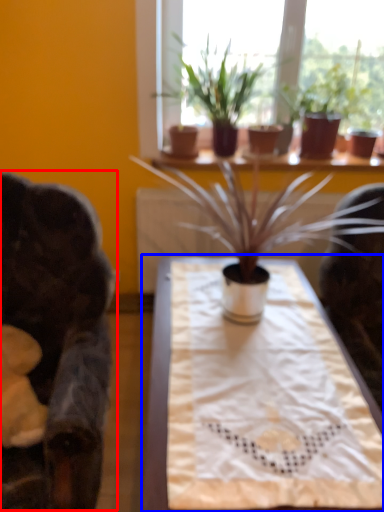
Question: Which object is further to the camera taking this photo, rocking chair (highlighted by a red box) or table (highlighted by a blue box)?

Choices:
 (A) rocking chair
 (B) table

Answer: (B)